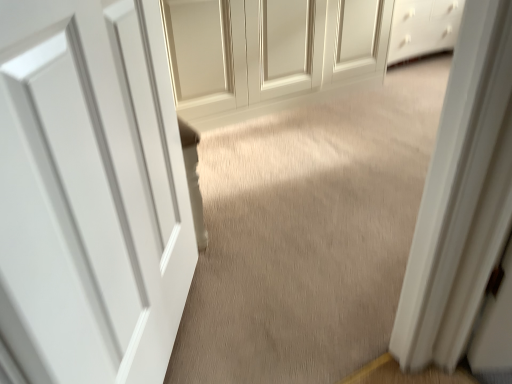
Question: Are beige carpet at center and matte white door at center, which is counted as the 1th door, starting from the right, beside each other?

Choices:
 (A) no
 (B) yes

Answer: (A)

Question: Considering the relative sizes of beige carpet at center and matte white door at center, which is counted as the 1th door, starting from the right, in the image provided, is beige carpet at center taller than matte white door at center, which is counted as the 1th door, starting from the right,?

Choices:
 (A) yes
 (B) no

Answer: (B)

Question: Can you confirm if beige carpet at center is smaller than matte white door at center, the 1th door positioned from the top?

Choices:
 (A) yes
 (B) no

Answer: (A)

Question: Considering the relative sizes of beige carpet at center and matte white door at center, the second door viewed from the front, in the image provided, is beige carpet at center bigger than matte white door at center, the second door viewed from the front,?

Choices:
 (A) no
 (B) yes

Answer: (A)

Question: From the image's perspective, is beige carpet at center under matte white door at center, positioned as the 2th door in bottom-to-top order?

Choices:
 (A) no
 (B) yes

Answer: (B)

Question: Is white smooth door at center, which is the 1th door in front-to-back order, in front of or behind matte white door at center, the second door viewed from the front, in the image?

Choices:
 (A) behind
 (B) front

Answer: (B)

Question: In the image, is white smooth door at center, which appears as the second door when viewed from the top, on the left side or the right side of matte white door at center, which is counted as the 1th door, starting from the right?

Choices:
 (A) left
 (B) right

Answer: (A)

Question: From a real-world perspective, is white smooth door at center, which ranks as the 1th door in bottom-to-top order, positioned above or below matte white door at center, which is the 2th door in left-to-right order?

Choices:
 (A) above
 (B) below

Answer: (A)

Question: From their relative heights in the image, would you say white smooth door at center, the second door in the back-to-front sequence, is taller or shorter than matte white door at center, the first door when ordered from back to front?

Choices:
 (A) tall
 (B) short

Answer: (A)

Question: Would you say beige carpet at center is to the left or to the right of white smooth door at center, the second door in the back-to-front sequence, in the picture?

Choices:
 (A) left
 (B) right

Answer: (B)

Question: Choose the correct answer: Is beige carpet at center inside white smooth door at center, acting as the 1th door starting from the left, or outside it?

Choices:
 (A) outside
 (B) inside

Answer: (A)

Question: Considering the positions of beige carpet at center and white smooth door at center, which ranks as the 1th door in bottom-to-top order, in the image, is beige carpet at center taller or shorter than white smooth door at center, which ranks as the 1th door in bottom-to-top order,?

Choices:
 (A) short
 (B) tall

Answer: (A)

Question: From the image's perspective, is beige carpet at center positioned above or below white smooth door at center, which is the 1th door in front-to-back order?

Choices:
 (A) above
 (B) below

Answer: (A)

Question: In the image, is matte white door at center, positioned as the 2th door in bottom-to-top order, positioned in front of or behind beige carpet at center?

Choices:
 (A) front
 (B) behind

Answer: (B)

Question: Considering the positions of matte white door at center, the second door viewed from the front, and beige carpet at center in the image, is matte white door at center, the second door viewed from the front, wider or thinner than beige carpet at center?

Choices:
 (A) wide
 (B) thin

Answer: (B)